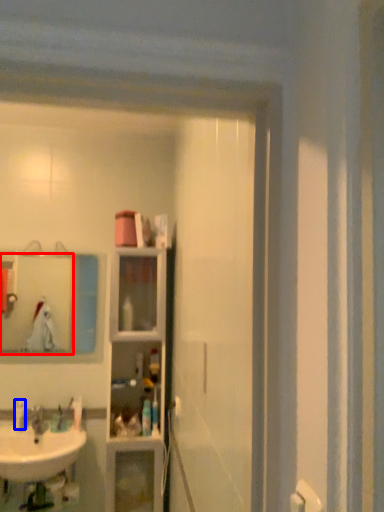
Question: Among these objects, which one is nearest to the camera, mirror (highlighted by a red box) or toiletry (highlighted by a blue box)?

Choices:
 (A) mirror
 (B) toiletry

Answer: (B)